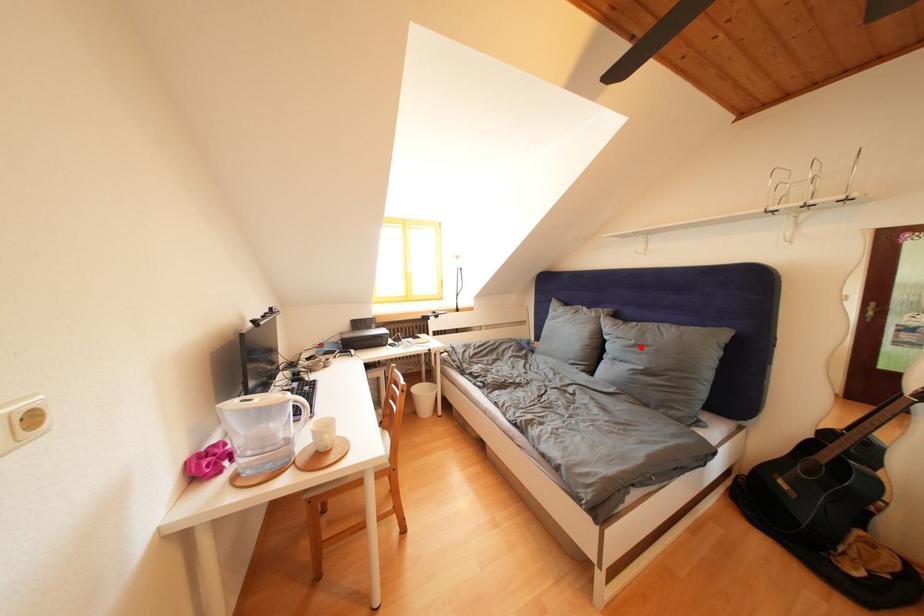
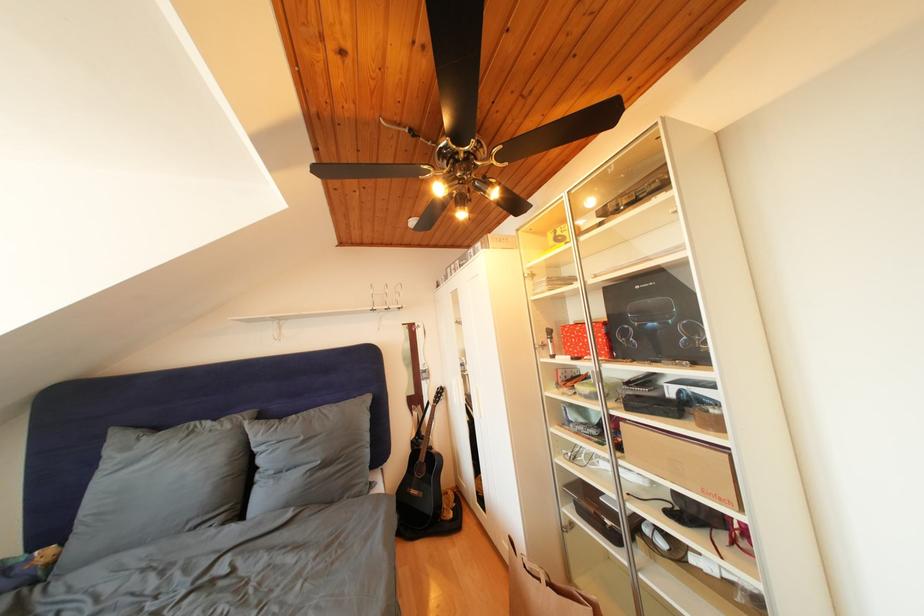
Question: A red point is marked in image1. In image2, is the corresponding 3D point closer to the camera or farther? Reply with the corresponding letter.

Choices:
 (A) The corresponding 3D point is closer.
 (B) The corresponding 3D point is farther.

Answer: (B)